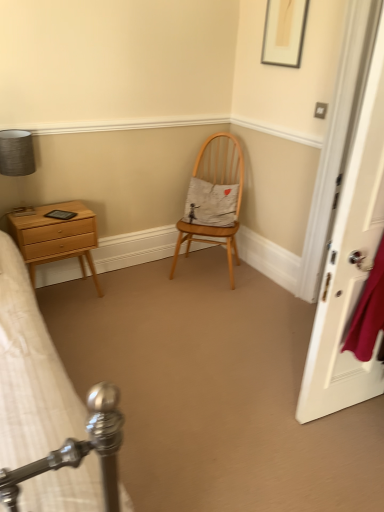
Question: Is light wood chair at center facing towards matte gray lampshade at upper left?

Choices:
 (A) no
 (B) yes

Answer: (A)

Question: Is the depth of light wood chair at center greater than that of matte gray lampshade at upper left?

Choices:
 (A) yes
 (B) no

Answer: (A)

Question: Is light wood chair at center shorter than matte gray lampshade at upper left?

Choices:
 (A) yes
 (B) no

Answer: (B)

Question: Could matte gray lampshade at upper left be considered to be inside light wood chair at center?

Choices:
 (A) yes
 (B) no

Answer: (B)

Question: Does light wood chair at center have a greater width compared to matte gray lampshade at upper left?

Choices:
 (A) yes
 (B) no

Answer: (A)

Question: Do you think light wood chair at center is within matte gray lampshade at upper left, or outside of it?

Choices:
 (A) inside
 (B) outside

Answer: (B)

Question: Relative to matte gray lampshade at upper left, is light wood chair at center in front or behind?

Choices:
 (A) front
 (B) behind

Answer: (B)

Question: Is light wood chair at center to the left or to the right of matte gray lampshade at upper left in the image?

Choices:
 (A) left
 (B) right

Answer: (B)

Question: Looking at their shapes, would you say light wood chair at center is wider or thinner than matte gray lampshade at upper left?

Choices:
 (A) thin
 (B) wide

Answer: (B)

Question: In the image, is matte gold picture frame at upper center on the left side or the right side of matte gray lampshade at upper left?

Choices:
 (A) right
 (B) left

Answer: (A)

Question: Does point (281, 37) appear closer or farther from the camera than point (8, 138)?

Choices:
 (A) farther
 (B) closer

Answer: (A)

Question: Which is correct: matte gold picture frame at upper center is inside matte gray lampshade at upper left, or outside of it?

Choices:
 (A) inside
 (B) outside

Answer: (B)

Question: From a real-world perspective, is matte gold picture frame at upper center positioned above or below matte gray lampshade at upper left?

Choices:
 (A) below
 (B) above

Answer: (B)

Question: Considering their positions, is light wood chair at center located in front of or behind light brown wood nightstand at left?

Choices:
 (A) behind
 (B) front

Answer: (A)

Question: From the image's perspective, is light wood chair at center above or below light brown wood nightstand at left?

Choices:
 (A) below
 (B) above

Answer: (B)